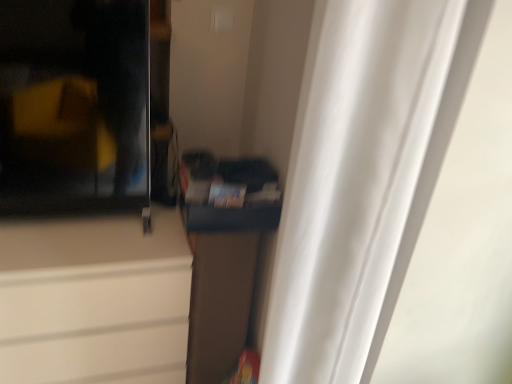
Question: Considering the positions of transparent glass screen door at upper left and white sheer curtain at right in the image, is transparent glass screen door at upper left taller or shorter than white sheer curtain at right?

Choices:
 (A) short
 (B) tall

Answer: (A)

Question: Is transparent glass screen door at upper left to the left or to the right of white sheer curtain at right in the image?

Choices:
 (A) right
 (B) left

Answer: (B)

Question: Which object is the closest to the matte white cabinet at left, which ranks as the second cabinetry in right-to-left order?

Choices:
 (A) brown fabric cabinet at center, positioned as the first cabinetry in right-to-left order
 (B) white sheer curtain at right
 (C) transparent glass screen door at upper left

Answer: (A)

Question: Considering the real-world distances, which object is farthest from the transparent glass screen door at upper left?

Choices:
 (A) matte white cabinet at left, which ranks as the second cabinetry in right-to-left order
 (B) white sheer curtain at right
 (C) brown fabric cabinet at center, positioned as the first cabinetry in right-to-left order

Answer: (B)